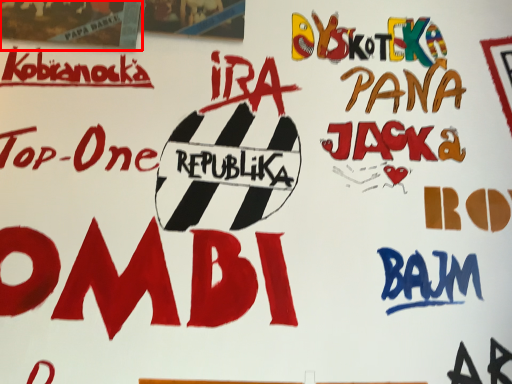
Question: Observing the image, what is the correct spatial positioning of poster (annotated by the red box) in reference to poster?

Choices:
 (A) right
 (B) left

Answer: (B)